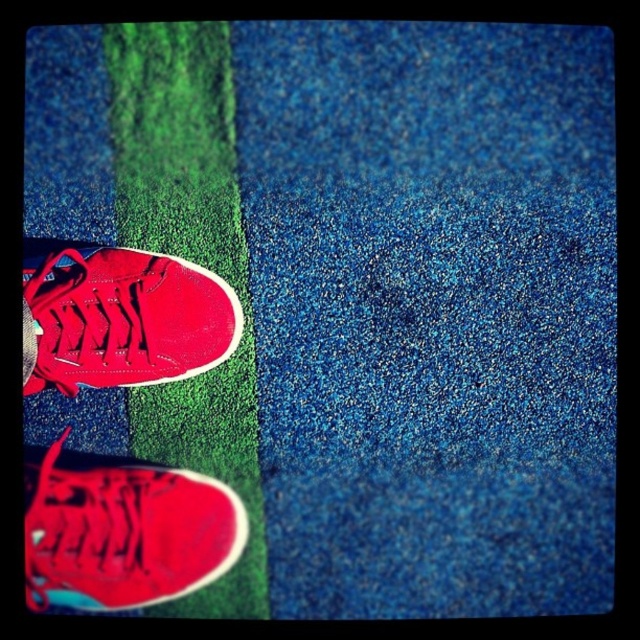
From the picture: Which of these two, shiny red sneaker at lower left or shiny red sneaker at center, stands taller?

shiny red sneaker at lower left is taller.

Does shiny red sneaker at lower left have a smaller size compared to shiny red sneaker at center?

Answer: Yes, shiny red sneaker at lower left is smaller than shiny red sneaker at center.

Does point (209, 564) lie in front of point (150, 369)?

No.

At what (x,y) coordinates should I click in order to perform the action: click on shiny red sneaker at lower left. Please return your answer as a coordinate pair (x, y). Looking at the image, I should click on (124, 532).